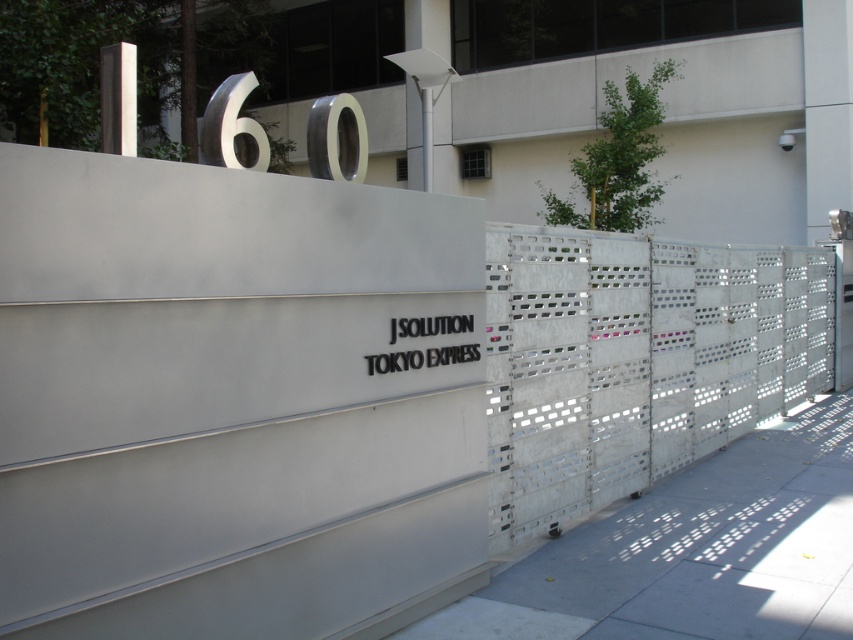
Between metallic perforated fence at right and black matte sign at center, which one has less height?

black matte sign at center is shorter.

This screenshot has height=640, width=853. In order to click on metallic perforated fence at right in this screenshot , I will do `click(613, 365)`.